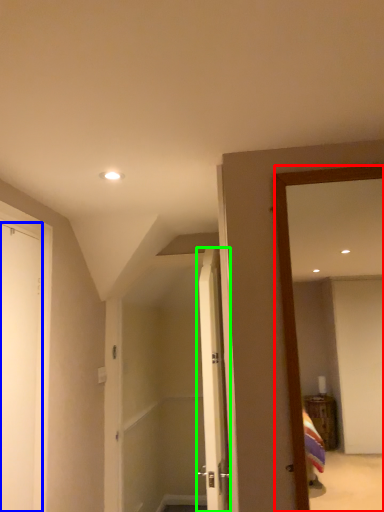
Question: Which is farther away from mirror (highlighted by a red box)? door (highlighted by a blue box) or door (highlighted by a green box)?

Choices:
 (A) door
 (B) door

Answer: (A)